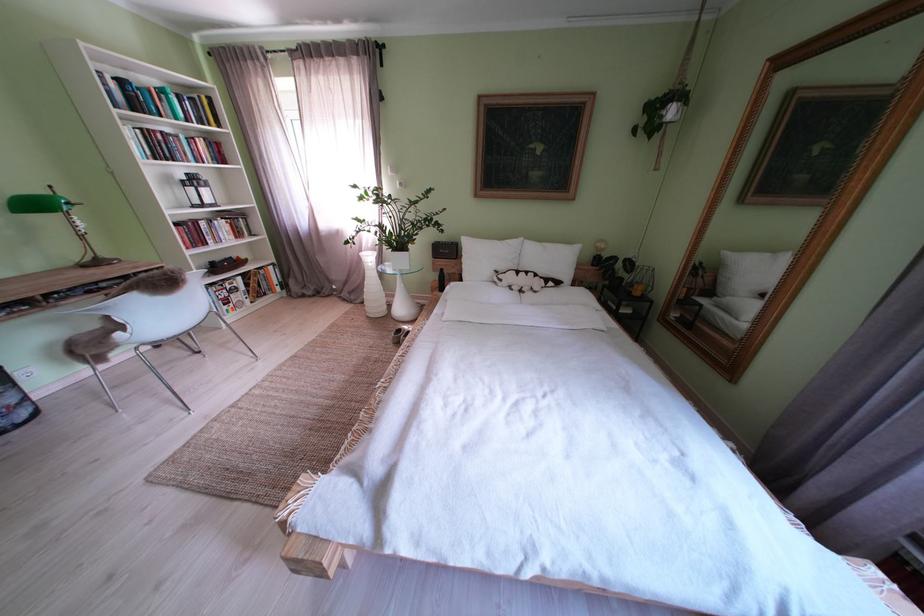
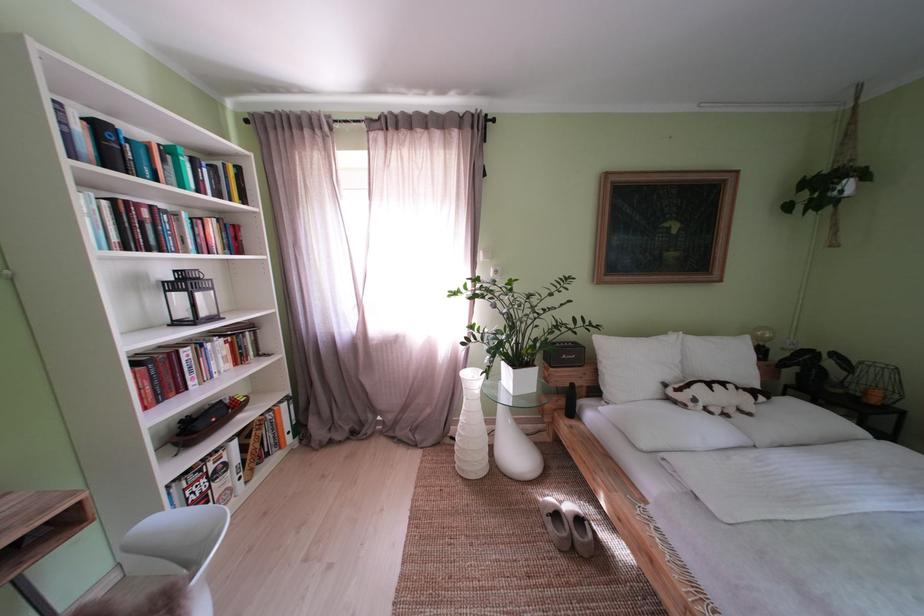
The point at (214, 229) is marked in the first image. Where is the corresponding point in the second image?

(199, 359)